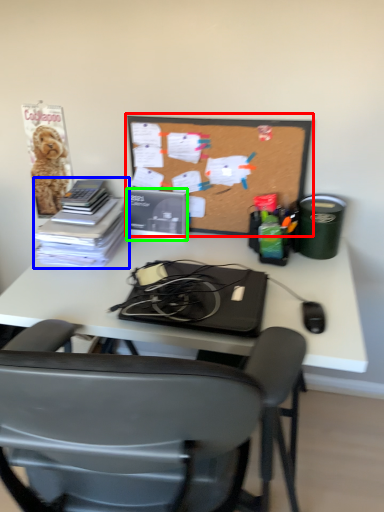
Question: Based on their relative distances, which object is nearer to bulletin board (highlighted by a red box)? Choose from book (highlighted by a blue box) and paperback book (highlighted by a green box).

Choices:
 (A) book
 (B) paperback book

Answer: (B)